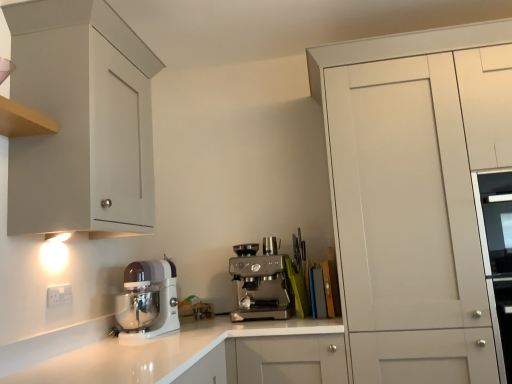
Question: Is matte gray cabinet at upper left, the first cabinetry viewed from the left, spatially inside white plastic electric outlet at lower left, or outside of it?

Choices:
 (A) outside
 (B) inside

Answer: (A)

Question: Is point (96, 49) closer or farther from the camera than point (69, 289)?

Choices:
 (A) farther
 (B) closer

Answer: (B)

Question: Estimate the real-world distances between objects in this image. Which object is farther from the white glossy stand mixer at lower left, which is counted as the first kitchen appliance, starting from the left?

Choices:
 (A) matte gray cabinet at upper left, the 2th cabinetry when ordered from right to left
 (B) white plastic electric outlet at lower left
 (C) white glossy countertop at center
 (D) satin silver espresso machine at center, which ranks as the second kitchen appliance in left-to-right order
 (E) white matte cabinet at right, the second cabinetry from the left

Answer: (E)

Question: Based on their relative distances, which object is nearer to the satin silver espresso machine at center, which ranks as the second kitchen appliance in left-to-right order?

Choices:
 (A) white glossy stand mixer at lower left, placed as the 2th kitchen appliance when sorted from right to left
 (B) white glossy countertop at center
 (C) white matte cabinet at right, the second cabinetry from the left
 (D) white plastic electric outlet at lower left
 (E) matte gray cabinet at upper left, the first cabinetry viewed from the left

Answer: (B)